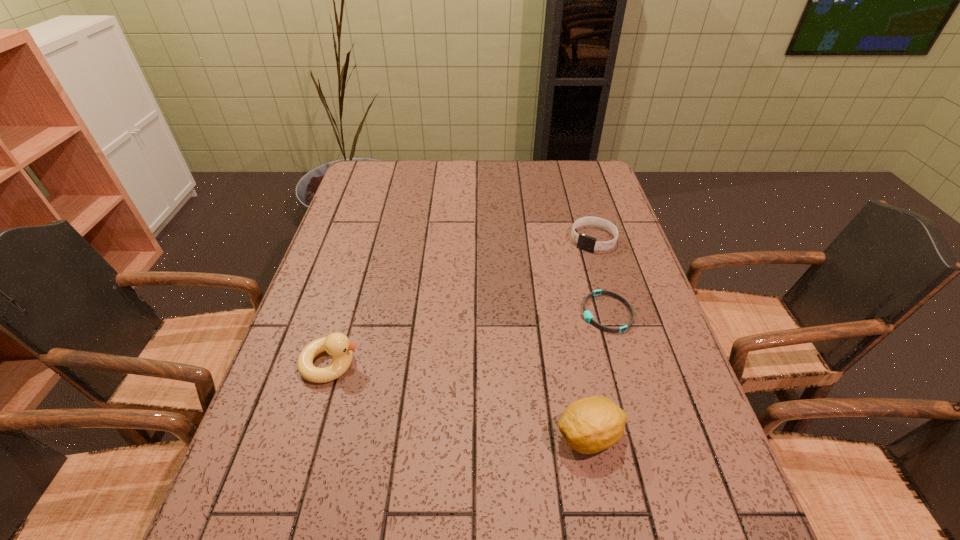
In the image, there is a desktop. At what (x,y) coordinates should I click in order to perform the action: click on free space at the left edge. Please return your answer as a coordinate pair (x, y). The width and height of the screenshot is (960, 540). Looking at the image, I should click on click(342, 219).

This screenshot has height=540, width=960. Find the location of `free spot at the right edge of the desktop`. free spot at the right edge of the desktop is located at coordinates (615, 382).

Image resolution: width=960 pixels, height=540 pixels. Identify the location of vacant space at the far left corner of the desktop. point(357,192).

Where is `vacant region at the far right corner of the desktop`? The height and width of the screenshot is (540, 960). vacant region at the far right corner of the desktop is located at coordinates (592, 174).

This screenshot has width=960, height=540. I want to click on empty space that is in between the farthest object and the lemon, so click(591, 338).

The image size is (960, 540). In order to click on free space between the shorter wristband and the third tallest object in this screenshot , I will do `click(600, 276)`.

Locate an element on the screen. The width and height of the screenshot is (960, 540). free space between the third farthest object and the farther wristband is located at coordinates click(x=462, y=301).

I want to click on blank region between the nearest object and the duckling, so click(460, 400).

Where is `empty space that is in between the farther wristband and the nearest object`? empty space that is in between the farther wristband and the nearest object is located at coordinates (591, 338).

Where is `vacant region between the farthest object and the shortest object`? vacant region between the farthest object and the shortest object is located at coordinates (600, 276).